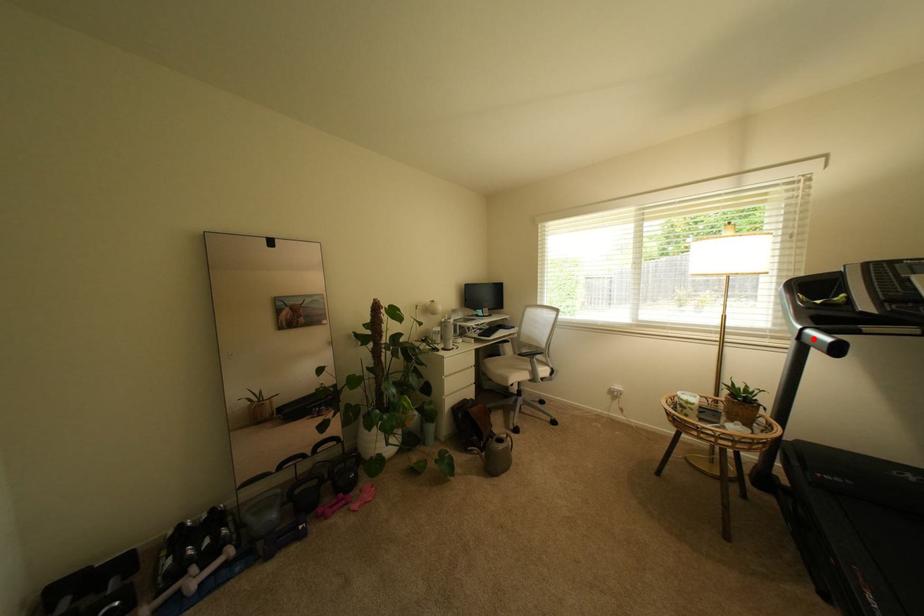
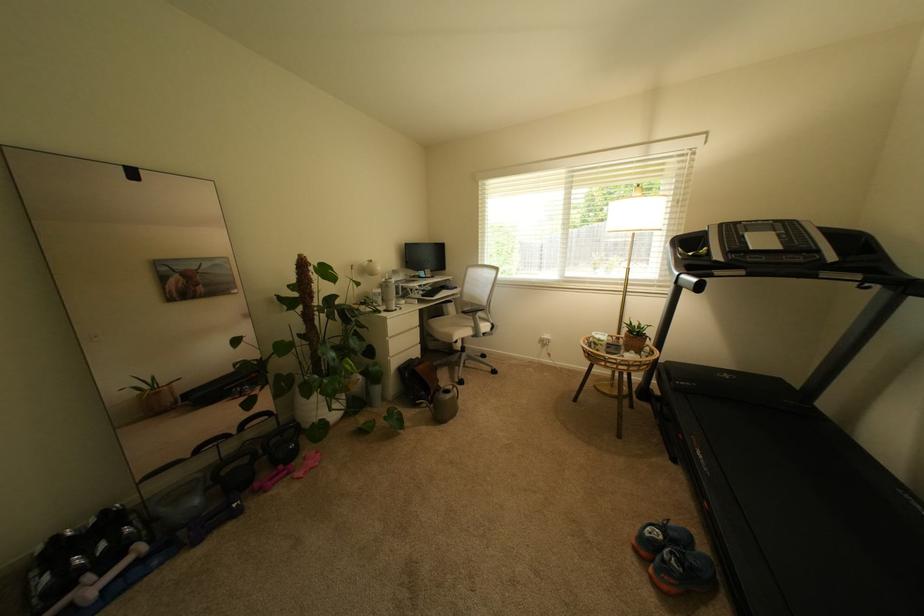
Locate, in the second image, the point that corresponds to the highlighted location in the first image.

(688, 283)